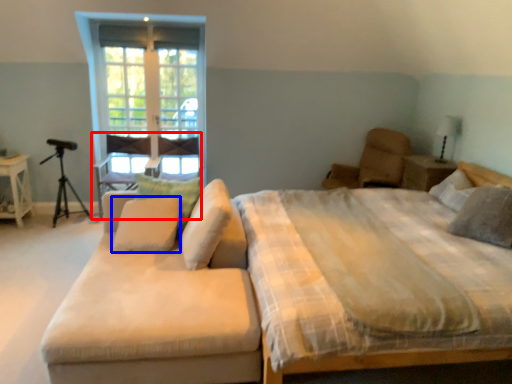
Question: Which of the following is the farthest to the observer, armchair (highlighted by a red box) or pillow (highlighted by a blue box)?

Choices:
 (A) armchair
 (B) pillow

Answer: (A)